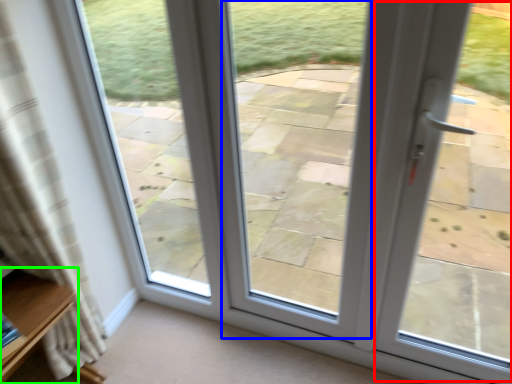
Question: Estimate the real-world distances between objects in this image. Which object is farther from screen door (highlighted by a red box), window (highlighted by a blue box) or furniture (highlighted by a green box)?

Choices:
 (A) window
 (B) furniture

Answer: (B)